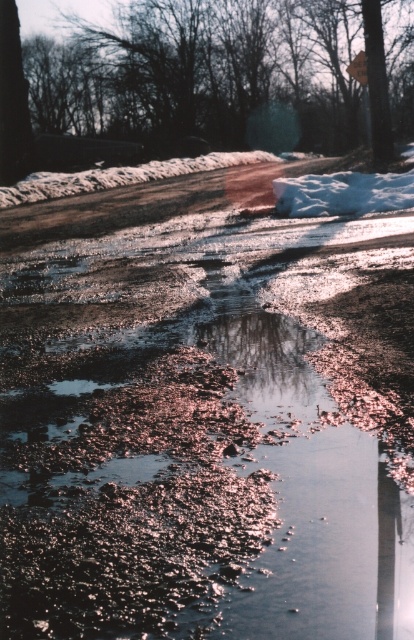
You are a photographer standing on the roadside and want to take a photo of the two points mentioned. The first point is at coordinate point (62,109) and the second point is at coordinate point (361,58). Since you want to focus on the closer point, which point should you focus on?

Point (62,109) is further to the camera than point (361,58), so you should focus on point (62,109).

You are driving a car and see the brown textured tree at upper center and the metallic reflective sign at upper center in your rearview mirror. Which object will appear first as you continue driving forward?

The brown textured tree at upper center will appear first in the rearview mirror because it is positioned to the left of the metallic reflective sign at upper center, meaning it is closer to the driver as they move forward.

You are a photographer setting up a tripod to capture the wintry scene. You notice the brown textured tree at upper center and the metallic reflective sign at upper center. Which object should you adjust your focus on if you want to ensure both are in frame but the tree takes up more space?

The brown textured tree at upper center might be wider than the metallic reflective sign at upper center, so focusing on the tree would ensure it occupies more space in the frame while still including the sign.